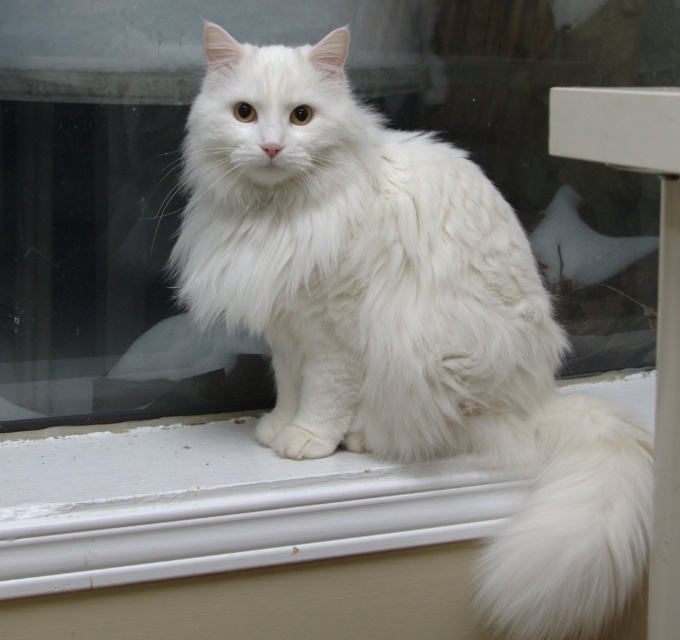
Question: Can you confirm if white fluffy cat at center is wider than white fluffy tail at lower right?

Choices:
 (A) yes
 (B) no

Answer: (A)

Question: Among these points, which one is nearest to the camera?

Choices:
 (A) (341, 97)
 (B) (520, 552)

Answer: (B)

Question: Is white fluffy cat at center thinner than white fluffy tail at lower right?

Choices:
 (A) yes
 (B) no

Answer: (B)

Question: Is white fluffy cat at center positioned behind white fluffy tail at lower right?

Choices:
 (A) yes
 (B) no

Answer: (A)

Question: Which object appears farthest from the camera in this image?

Choices:
 (A) white fluffy tail at lower right
 (B) white fluffy cat at center

Answer: (B)